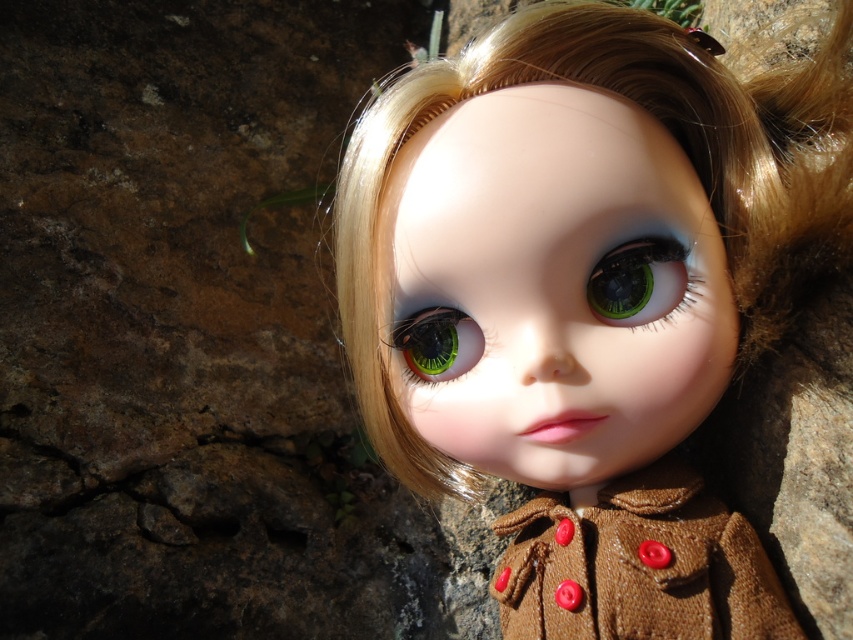
You are a photographer adjusting the focus on your camera. You want to ensure that both the matte brown coat at center and the green glossy eye at center are in focus. Given their positions, which object should you focus on first to achieve this?

The matte brown coat at center is closer to the viewer than the green glossy eye at center. To ensure both are in focus, you should focus on the matte brown coat at center first, as it is the closer object, and adjust the depth of field accordingly.

You are a tailor who needs to determine which coat to alter for a client. The client prefers a coat that is not too bulky. Based on the image, which coat between the matte brown coat at center and the brown textured coat at center should you recommend?

The matte brown coat at center is larger in size than the brown textured coat at center, so the brown textured coat at center would be less bulky and more suitable for the client.